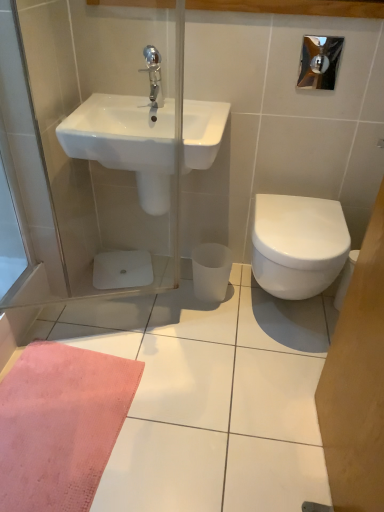
Question: Does white glossy bidet at right have a lesser height compared to white glossy sink at upper left?

Choices:
 (A) yes
 (B) no

Answer: (B)

Question: Considering the relative sizes of white glossy bidet at right and white glossy sink at upper left in the image provided, is white glossy bidet at right taller than white glossy sink at upper left?

Choices:
 (A) yes
 (B) no

Answer: (A)

Question: From the image's perspective, is white glossy bidet at right on top of white glossy sink at upper left?

Choices:
 (A) no
 (B) yes

Answer: (A)

Question: Does white glossy bidet at right lie in front of white glossy sink at upper left?

Choices:
 (A) no
 (B) yes

Answer: (A)

Question: From a real-world perspective, is white glossy bidet at right below white glossy sink at upper left?

Choices:
 (A) no
 (B) yes

Answer: (B)

Question: In terms of height, does white glossy sink at upper left look taller or shorter compared to chrome metallic faucet at upper center?

Choices:
 (A) short
 (B) tall

Answer: (B)

Question: Considering the relative positions of white glossy sink at upper left and chrome metallic faucet at upper center in the image provided, is white glossy sink at upper left to the left or to the right of chrome metallic faucet at upper center?

Choices:
 (A) right
 (B) left

Answer: (B)

Question: Does point pyautogui.click(x=137, y=181) appear closer or farther from the camera than point pyautogui.click(x=158, y=54)?

Choices:
 (A) farther
 (B) closer

Answer: (A)

Question: Is white glossy sink at upper left in front of or behind chrome metallic faucet at upper center in the image?

Choices:
 (A) front
 (B) behind

Answer: (A)

Question: Would you say white glossy bidet at right is inside or outside chrome metallic faucet at upper center?

Choices:
 (A) inside
 (B) outside

Answer: (B)

Question: Considering the relative positions of white glossy bidet at right and chrome metallic faucet at upper center in the image provided, is white glossy bidet at right to the left or to the right of chrome metallic faucet at upper center?

Choices:
 (A) right
 (B) left

Answer: (A)

Question: Is white glossy bidet at right wider or thinner than chrome metallic faucet at upper center?

Choices:
 (A) wide
 (B) thin

Answer: (A)

Question: Considering the positions of white glossy bidet at right and chrome metallic faucet at upper center in the image, is white glossy bidet at right taller or shorter than chrome metallic faucet at upper center?

Choices:
 (A) tall
 (B) short

Answer: (A)

Question: Is white glossy bidet at right taller or shorter than white glossy sink at upper left?

Choices:
 (A) short
 (B) tall

Answer: (B)

Question: Considering the positions of white glossy bidet at right and white glossy sink at upper left in the image, is white glossy bidet at right wider or thinner than white glossy sink at upper left?

Choices:
 (A) wide
 (B) thin

Answer: (A)